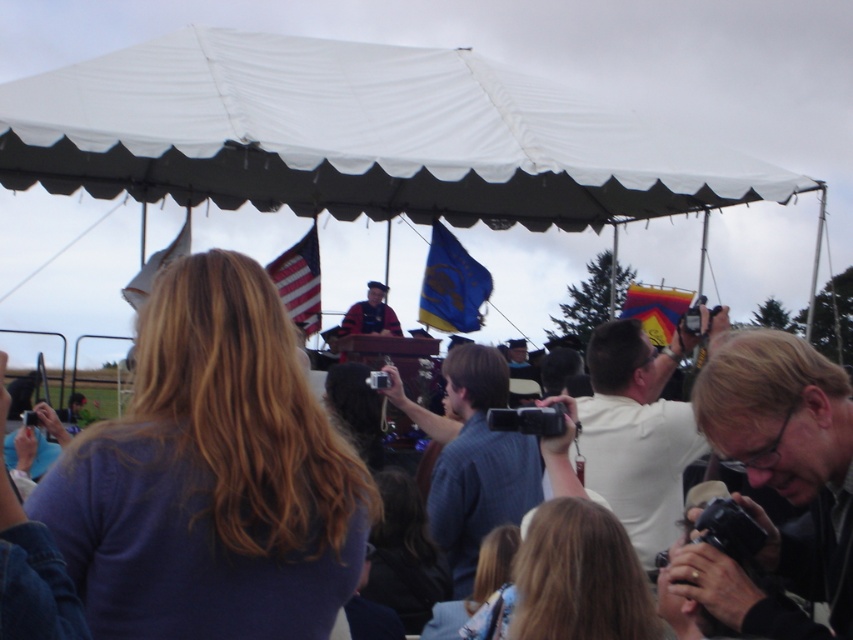
You are a photographer at the event and need to take a photo of the speaker. You have a black plastic camera at right and a blue plaid shirt at center. Which object is positioned higher in your view?

The black plastic camera at right is above the blue plaid shirt at center, so it is positioned higher in your view.

You are a photographer at the event and want to capture both the blue fabric flag at upper center and the american flag at upper center in a single frame. However, you notice that the American flag has specific display rules requiring it to either be above other flags or to its right. Based on the current arrangement, can you include both flags in your photo without violating these rules?

The american flag at upper center is behind blue fabric flag at upper center, meaning it is not above or to the right of the blue fabric flag at upper center. Therefore, including both flags in the photo as they are arranged would violate the display rules requiring the American flag to be either above or to the right of other flags.